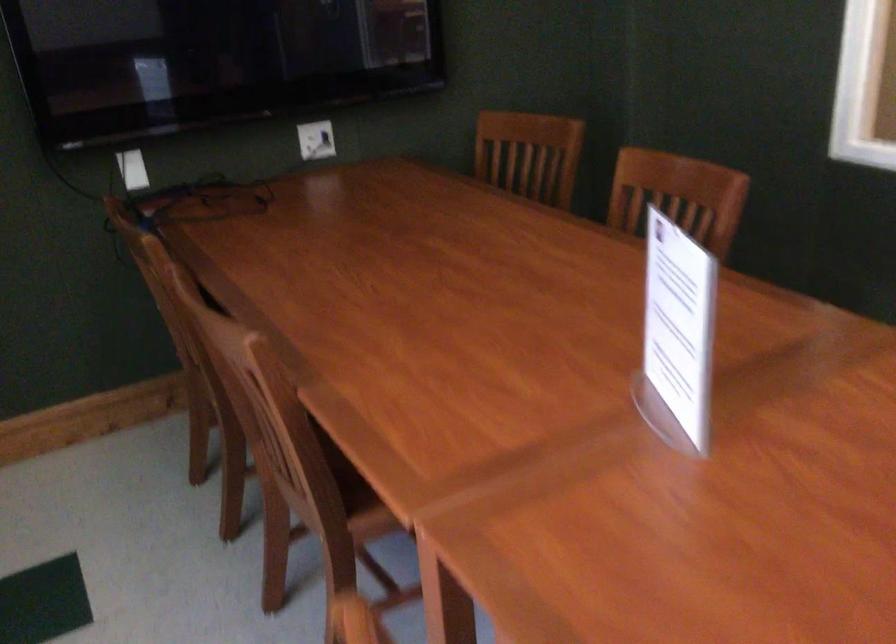
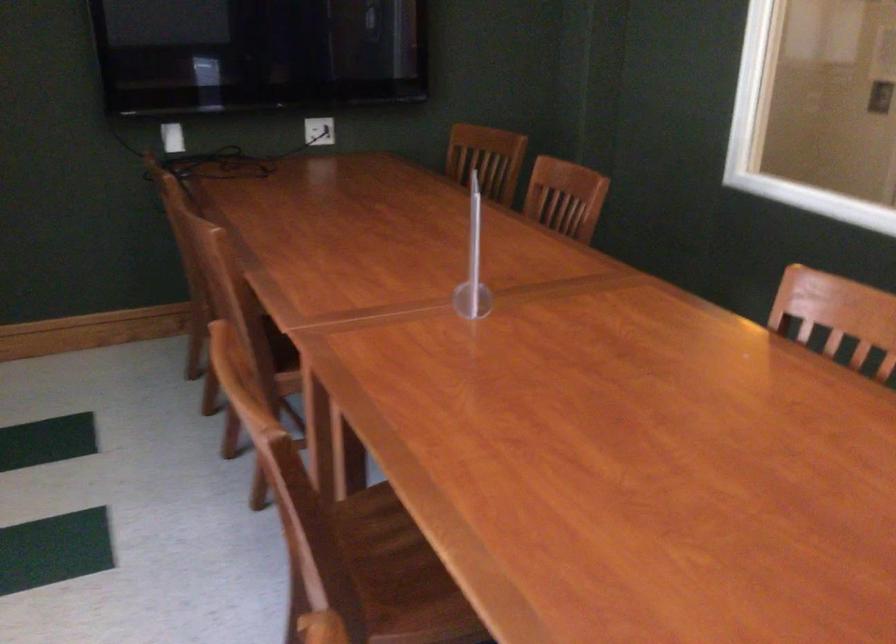
Question: The images are taken continuously from a first-person perspective. In which direction is your viewpoint rotating?

Choices:
 (A) Left
 (B) Right
 (C) Up
 (D) Down

Answer: (A)